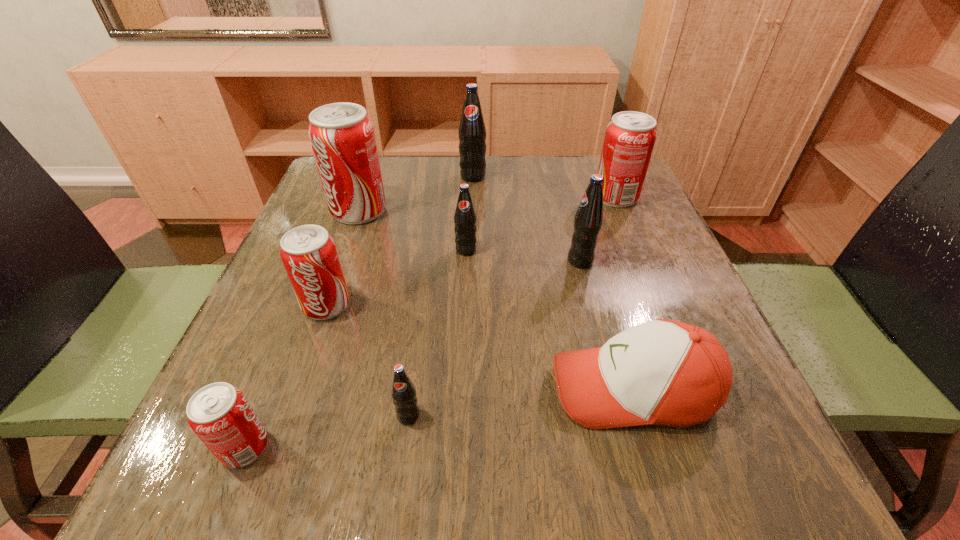
Locate an element on the screen. object present at the far left corner is located at coordinates (342, 137).

This screenshot has height=540, width=960. In order to click on object that is at the near left corner in this screenshot , I will do `click(220, 415)`.

At what (x,y) coordinates should I click in order to perform the action: click on object that is positioned at the far right corner. Please return your answer as a coordinate pair (x, y). Image resolution: width=960 pixels, height=540 pixels. Looking at the image, I should click on (630, 137).

The width and height of the screenshot is (960, 540). I want to click on vacant space at the far edge of the desktop, so click(x=388, y=192).

Identify the location of vacant space at the left edge of the desktop. The height and width of the screenshot is (540, 960). pos(260,417).

Where is `blank space at the right edge of the desktop`? The width and height of the screenshot is (960, 540). blank space at the right edge of the desktop is located at coordinates (743, 423).

Locate an element on the screen. This screenshot has height=540, width=960. vacant space at the near left corner is located at coordinates (290, 465).

In the image, there is a desktop. Where is `vacant space at the far right corner`? vacant space at the far right corner is located at coordinates (576, 169).

Locate an element on the screen. blank region between the baseball cap and the second smallest black pop is located at coordinates (550, 319).

What are the coordinates of `free space that is in between the second smallest black pop and the baseball cap` in the screenshot? It's located at coord(550,319).